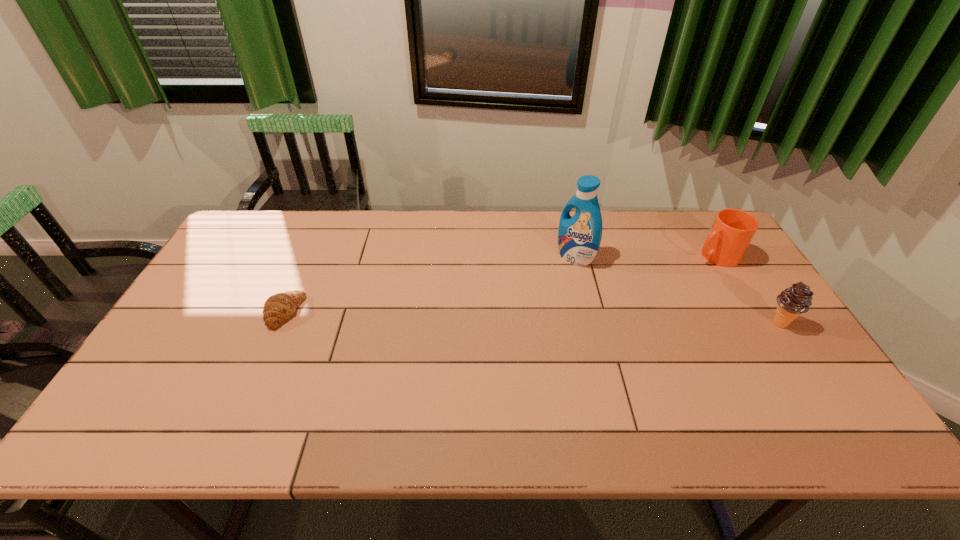
Identify the location of vacant point that satisfies the following two spatial constraints: 1. on the back side of the crescent roll; 2. on the right side of the detergent. (308, 257).

Identify the location of free space that satisfies the following two spatial constraints: 1. on the back side of the third object from right to left; 2. on the right side of the mug. (575, 255).